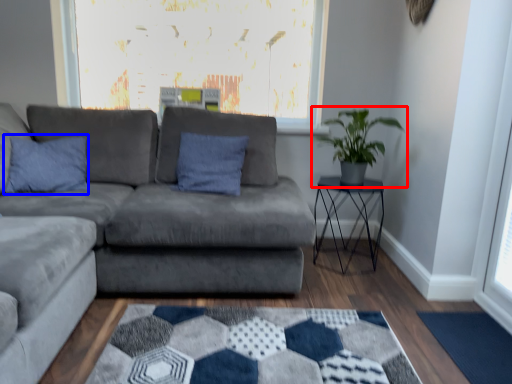
Question: Which object appears closest to the camera in this image, houseplant (highlighted by a red box) or pillow (highlighted by a blue box)?

Choices:
 (A) houseplant
 (B) pillow

Answer: (B)